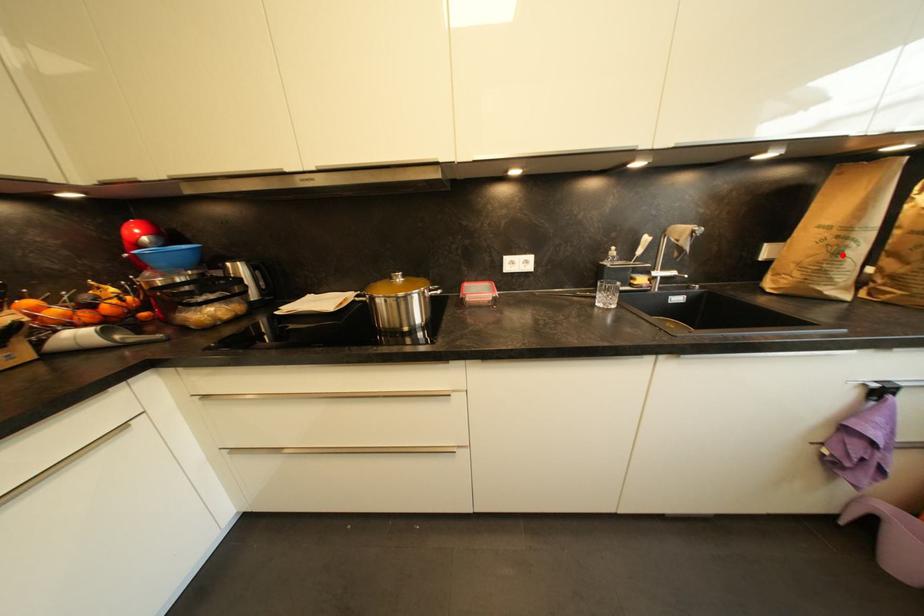
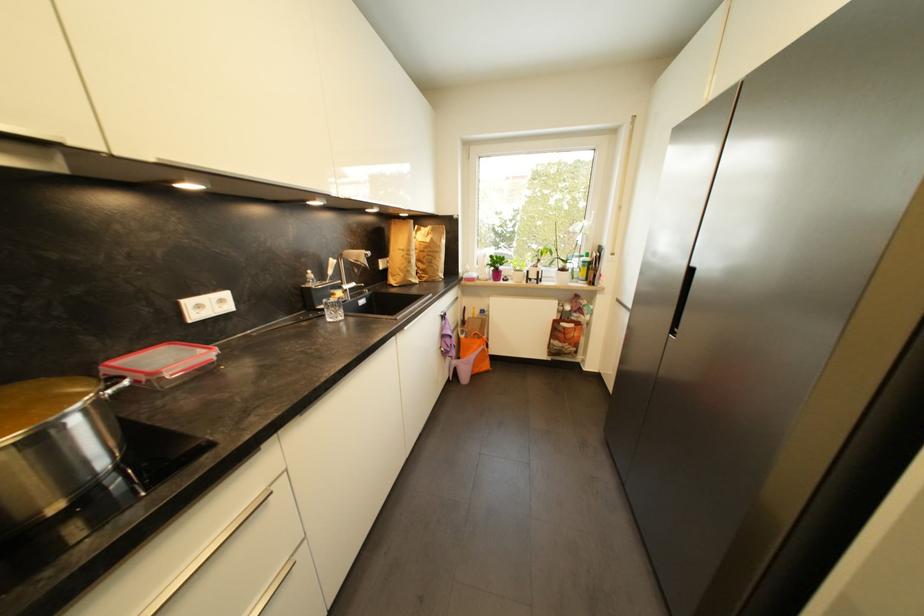
The point at the highlighted location is marked in the first image. Where is the corresponding point in the second image?

(415, 264)